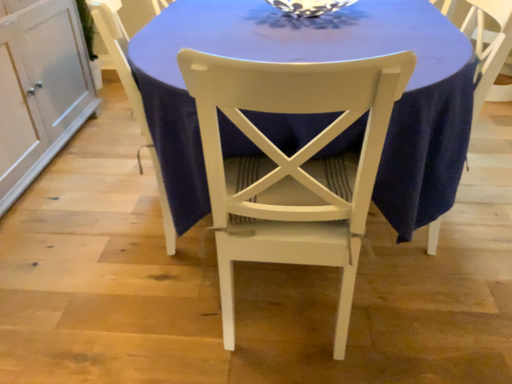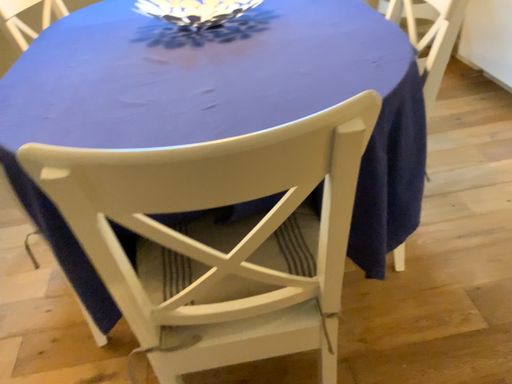
Question: How did the camera likely rotate when shooting the video?

Choices:
 (A) rotated left
 (B) rotated right

Answer: (B)